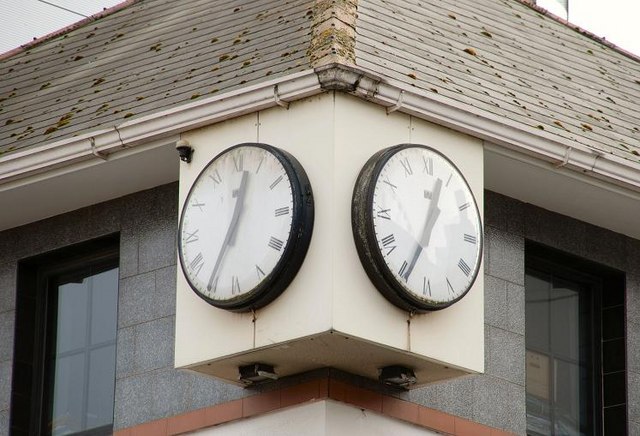
This screenshot has height=436, width=640. I want to click on 2 brackets under clocks, so click(x=255, y=371), click(x=390, y=380).